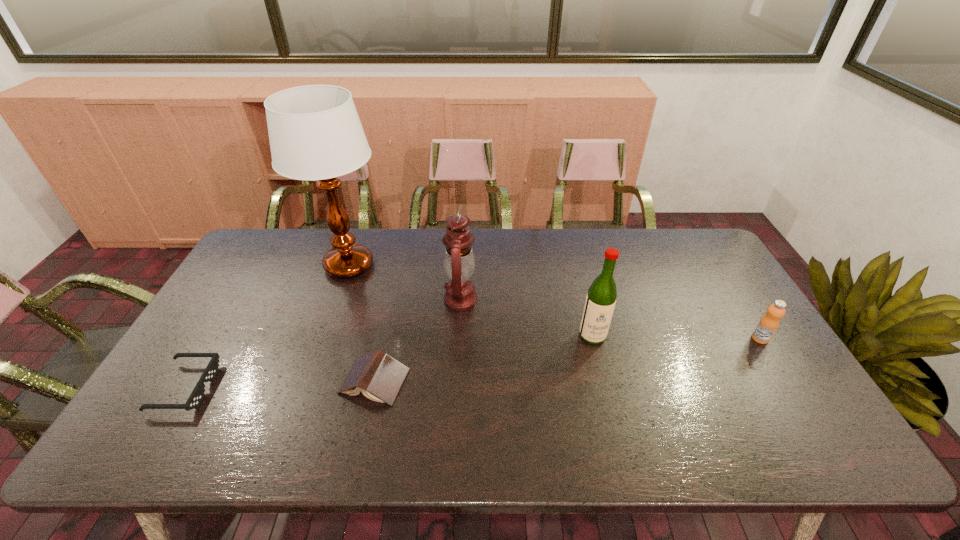
At what (x,y) coordinates should I click in order to perform the action: click on blank space located 0.190m on the label of the second object from right to left. Please return your answer as a coordinate pair (x, y). This screenshot has height=540, width=960. Looking at the image, I should click on (611, 406).

Identify the location of vacant space located 0.190m on the front label of the rightmost object. (801, 404).

Image resolution: width=960 pixels, height=540 pixels. Find the location of `vacant point located on the back of the fifth tallest object`. vacant point located on the back of the fifth tallest object is located at coordinates (389, 315).

Locate an element on the screen. The width and height of the screenshot is (960, 540). free space located on the front-facing side of the leftmost object is located at coordinates (245, 388).

Locate an element on the screen. This screenshot has width=960, height=540. object that is at the far edge is located at coordinates (315, 133).

This screenshot has height=540, width=960. What are the coordinates of `object present at the left edge` in the screenshot? It's located at pyautogui.click(x=197, y=395).

This screenshot has height=540, width=960. I want to click on object that is at the right edge, so click(x=768, y=324).

The height and width of the screenshot is (540, 960). Identify the location of vacant space at the far edge of the desktop. (654, 239).

The height and width of the screenshot is (540, 960). I want to click on vacant space at the near edge of the desktop, so click(x=275, y=424).

The image size is (960, 540). I want to click on vacant area at the left edge of the desktop, so click(x=176, y=369).